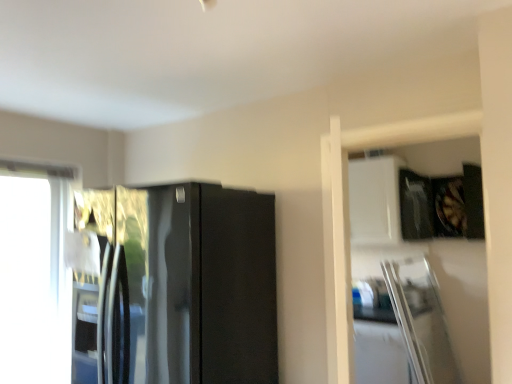
What do you see at coordinates (34, 273) in the screenshot? I see `transparent glass window at left` at bounding box center [34, 273].

Consider the image. Measure the distance between transparent glass window at left and camera.

A distance of 2.45 meters exists between transparent glass window at left and camera.

At what (x,y) coordinates should I click in order to perform the action: click on transparent glass window at left. Please return your answer as a coordinate pair (x, y). The image size is (512, 384). Looking at the image, I should click on (34, 273).

The image size is (512, 384). What do you see at coordinates (174, 285) in the screenshot?
I see `glossy black refrigerator at center` at bounding box center [174, 285].

Image resolution: width=512 pixels, height=384 pixels. In order to click on glossy black refrigerator at center in this screenshot , I will do `click(174, 285)`.

I want to click on transparent glass window at left, so click(34, 273).

Considering the positions of objects glossy black refrigerator at center and transparent glass window at left in the image provided, who is more to the left, glossy black refrigerator at center or transparent glass window at left?

Positioned to the left is transparent glass window at left.

Is glossy black refrigerator at center in front of or behind transparent glass window at left in the image?

In the image, glossy black refrigerator at center appears in front of transparent glass window at left.

Considering the positions of point (233, 217) and point (21, 219), is point (233, 217) closer or farther from the camera than point (21, 219)?

Point (233, 217) is positioned closer to the camera compared to point (21, 219).

From the image's perspective, would you say glossy black refrigerator at center is positioned over transparent glass window at left?

Yes, from the image's perspective, glossy black refrigerator at center is above transparent glass window at left.

Consider the image. From a real-world perspective, is glossy black refrigerator at center positioned above or below transparent glass window at left?

Clearly, from a real-world perspective, glossy black refrigerator at center is below transparent glass window at left.

In terms of width, does glossy black refrigerator at center look wider or thinner when compared to transparent glass window at left?

Clearly, glossy black refrigerator at center has more width compared to transparent glass window at left.

Which of these two, glossy black refrigerator at center or transparent glass window at left, stands shorter?

glossy black refrigerator at center.

Does glossy black refrigerator at center have a larger size compared to transparent glass window at left?

Yes, glossy black refrigerator at center is bigger than transparent glass window at left.

Is glossy black refrigerator at center surrounding transparent glass window at left?

No, transparent glass window at left is not a part of glossy black refrigerator at center.

Consider the image. Is glossy black refrigerator at center far from transparent glass window at left?

Yes, glossy black refrigerator at center and transparent glass window at left are quite far apart.

Is glossy black refrigerator at center looking in the opposite direction of transparent glass window at left?

No.

Identify the location of refrigerator lying above the transparent glass window at left (from the image's perspective). (174, 285).

Considering the relative positions of transparent glass window at left and glossy black refrigerator at center in the image provided, is transparent glass window at left to the left of glossy black refrigerator at center from the viewer's perspective?

Yes.

Is transparent glass window at left further to the viewer compared to glossy black refrigerator at center?

Yes, it is.

Is point (0, 238) in front of point (267, 323)?

No.

From the image's perspective, does transparent glass window at left appear higher than glossy black refrigerator at center?

Actually, transparent glass window at left appears below glossy black refrigerator at center in the image.

From a real-world perspective, is transparent glass window at left beneath glossy black refrigerator at center?

Actually, transparent glass window at left is physically above glossy black refrigerator at center in the real world.

Is transparent glass window at left wider or thinner than glossy black refrigerator at center?

transparent glass window at left is thinner than glossy black refrigerator at center.

In terms of height, does transparent glass window at left look taller or shorter compared to glossy black refrigerator at center?

Clearly, transparent glass window at left is taller compared to glossy black refrigerator at center.

Between transparent glass window at left and glossy black refrigerator at center, which one has smaller size?

transparent glass window at left is smaller.

Would you say transparent glass window at left is inside or outside glossy black refrigerator at center?

transparent glass window at left is spatially situated outside glossy black refrigerator at center.

Is there a large distance between transparent glass window at left and glossy black refrigerator at center?

transparent glass window at left is far away from glossy black refrigerator at center.

Is transparent glass window at left facing towards glossy black refrigerator at center?

Yes, transparent glass window at left is facing glossy black refrigerator at center.

What's the angular difference between transparent glass window at left and glossy black refrigerator at center's facing directions?

91.3 degrees separate the facing orientations of transparent glass window at left and glossy black refrigerator at center.

How distant is transparent glass window at left from glossy black refrigerator at center?

transparent glass window at left is 1.05 meters away from glossy black refrigerator at center.

Locate an element on the screen. The height and width of the screenshot is (384, 512). refrigerator that is on the right side of transparent glass window at left is located at coordinates (174, 285).

Locate an element on the screen. Image resolution: width=512 pixels, height=384 pixels. window to the left of glossy black refrigerator at center is located at coordinates (34, 273).

At what (x,y) coordinates should I click in order to perform the action: click on refrigerator that appears above the transparent glass window at left (from the image's perspective). Please return your answer as a coordinate pair (x, y). The width and height of the screenshot is (512, 384). Looking at the image, I should click on (174, 285).